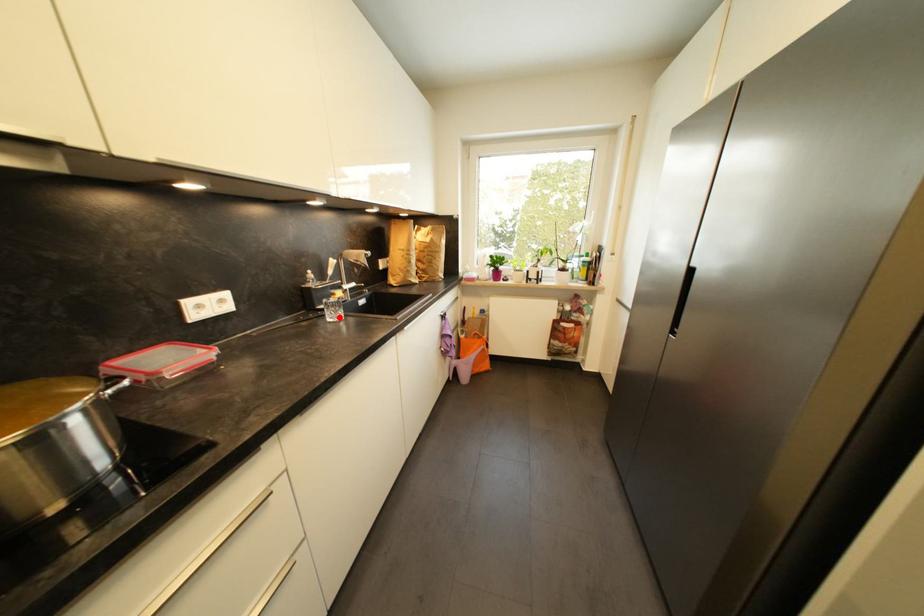
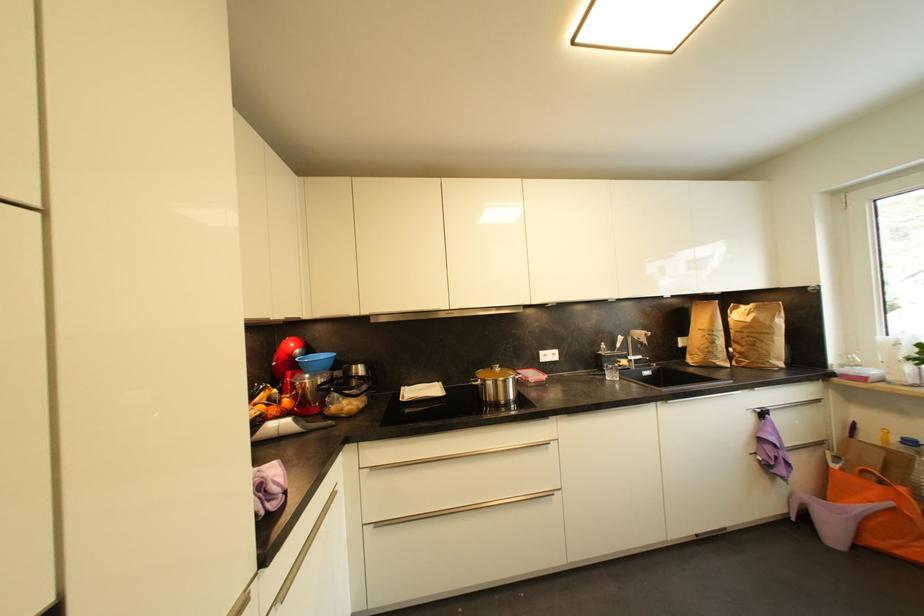
Locate, in the second image, the point that corresponds to the highlighted location in the first image.

(616, 378)